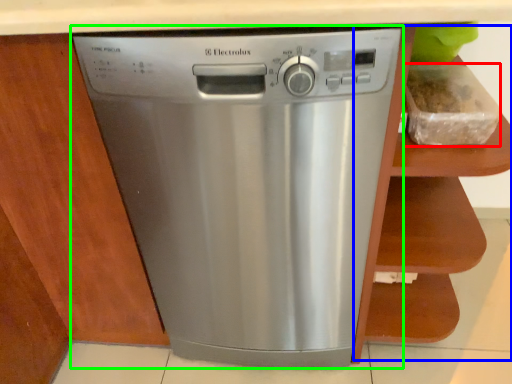
Question: Considering the real-world distances, which object is farthest from food (highlighted by a red box)? cabinet (highlighted by a blue box) or home appliance (highlighted by a green box)?

Choices:
 (A) cabinet
 (B) home appliance

Answer: (B)